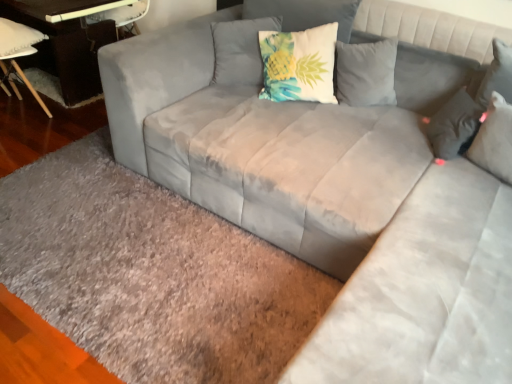
Question: Does dark brown wood table at left turn towards gray shaggy rug at lower left?

Choices:
 (A) yes
 (B) no

Answer: (B)

Question: Can you confirm if dark brown wood table at left is smaller than gray shaggy rug at lower left?

Choices:
 (A) yes
 (B) no

Answer: (B)

Question: Is dark brown wood table at left facing away from gray shaggy rug at lower left?

Choices:
 (A) no
 (B) yes

Answer: (A)

Question: Is the position of dark brown wood table at left more distant than that of gray shaggy rug at lower left?

Choices:
 (A) no
 (B) yes

Answer: (B)

Question: Considering the relative sizes of dark brown wood table at left and gray shaggy rug at lower left in the image provided, is dark brown wood table at left bigger than gray shaggy rug at lower left?

Choices:
 (A) yes
 (B) no

Answer: (A)

Question: Is suede gray pillow at upper right, which is the first pillow from right to left, inside the boundaries of white fabric chair at lower left, or outside?

Choices:
 (A) inside
 (B) outside

Answer: (B)

Question: Based on their sizes in the image, would you say suede gray pillow at upper right, which is the first pillow from right to left, is bigger or smaller than white fabric chair at lower left?

Choices:
 (A) small
 (B) big

Answer: (A)

Question: In terms of width, does suede gray pillow at upper right, which is the first pillow from right to left, look wider or thinner when compared to white fabric chair at lower left?

Choices:
 (A) wide
 (B) thin

Answer: (B)

Question: From the image's perspective, is suede gray pillow at upper right, which is the first pillow from right to left, above or below white fabric chair at lower left?

Choices:
 (A) below
 (B) above

Answer: (A)

Question: In terms of width, does suede gray pillow at upper right, which is the first pillow from right to left, look wider or thinner when compared to gray shaggy rug at lower left?

Choices:
 (A) thin
 (B) wide

Answer: (A)

Question: From a real-world perspective, is suede gray pillow at upper right, which is the first pillow from right to left, positioned above or below gray shaggy rug at lower left?

Choices:
 (A) above
 (B) below

Answer: (A)

Question: Considering the relative positions of suede gray pillow at upper right, marked as the 3th pillow in a left-to-right arrangement, and gray shaggy rug at lower left in the image provided, is suede gray pillow at upper right, marked as the 3th pillow in a left-to-right arrangement, to the left or to the right of gray shaggy rug at lower left?

Choices:
 (A) left
 (B) right

Answer: (B)

Question: Considering the positions of suede gray pillow at upper right, marked as the 3th pillow in a left-to-right arrangement, and gray shaggy rug at lower left in the image, is suede gray pillow at upper right, marked as the 3th pillow in a left-to-right arrangement, taller or shorter than gray shaggy rug at lower left?

Choices:
 (A) tall
 (B) short

Answer: (A)

Question: Would you say gray shaggy rug at lower left is inside or outside teal fabric pillow at upper center, acting as the third pillow starting from the right?

Choices:
 (A) outside
 (B) inside

Answer: (A)

Question: Visually, is gray shaggy rug at lower left positioned to the left or to the right of teal fabric pillow at upper center, acting as the third pillow starting from the right?

Choices:
 (A) right
 (B) left

Answer: (B)